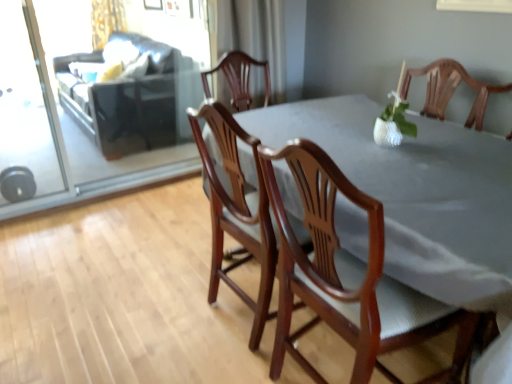
Question: Visually, is dark brown leather couch at upper left positioned to the left or to the right of gold textured curtain at upper left, which is counted as the first curtain, starting from the left?

Choices:
 (A) left
 (B) right

Answer: (B)

Question: From a real-world perspective, is dark brown leather couch at upper left above or below gold textured curtain at upper left, the 1th curtain viewed from the back?

Choices:
 (A) above
 (B) below

Answer: (B)

Question: Considering the real-world distances, which object is farthest from the wooden table at center?

Choices:
 (A) transparent glass screen door at upper left, acting as the 2th screen door starting from the left
 (B) mahogany wood chair at center, which ranks as the 1th chair in right-to-left order
 (C) white sheer curtain at upper center, which is the 2th curtain in back-to-front order
 (D) wooden chair at center, which is the 2th chair in right-to-left order
 (E) clear glass screen door at left, the 2th screen door positioned from the right

Answer: (E)

Question: Which object is positioned closest to the dark brown leather couch at upper left?

Choices:
 (A) gold textured curtain at upper left, arranged as the 1th curtain when viewed from the top
 (B) wooden chair at center, acting as the first chair starting from the left
 (C) transparent glass screen door at upper left, the first screen door in the right-to-left sequence
 (D) clear glass screen door at left, acting as the 1th screen door starting from the left
 (E) white sheer curtain at upper center, arranged as the 1th curtain when ordered from the bottom

Answer: (C)